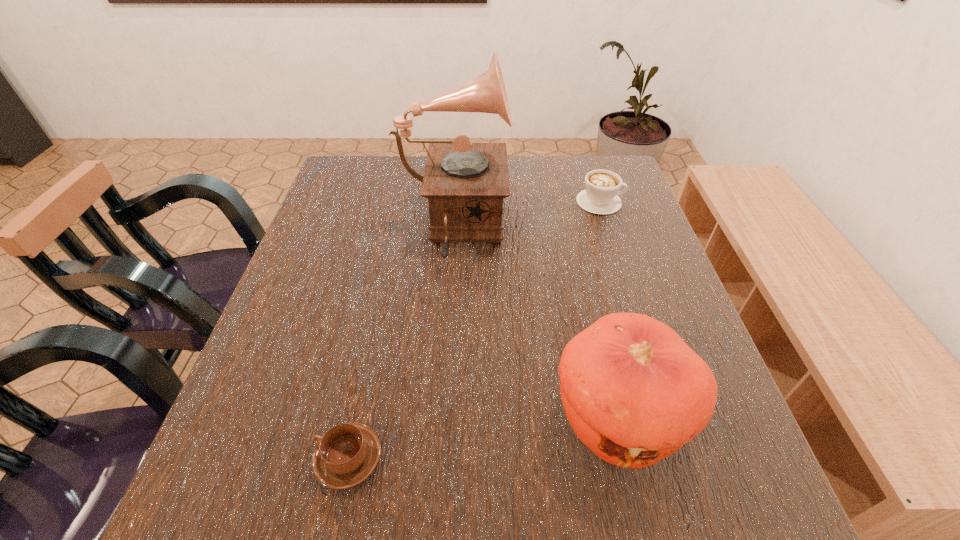
I want to click on record player, so pos(465,183).

This screenshot has height=540, width=960. I want to click on the second tallest object, so click(x=634, y=392).

The height and width of the screenshot is (540, 960). What are the coordinates of `the taller cappuccino` in the screenshot? It's located at (600, 196).

I want to click on the second shortest object, so click(x=600, y=196).

I want to click on the left cappuccino, so click(347, 454).

Find the location of a particular element. The height and width of the screenshot is (540, 960). the shorter cappuccino is located at coordinates (347, 454).

The image size is (960, 540). I want to click on free location located 0.100m on the horn of the tallest object, so click(x=547, y=231).

Where is `vacant region located on the back of the pumpkin`? This screenshot has height=540, width=960. vacant region located on the back of the pumpkin is located at coordinates (581, 264).

You are a GUI agent. You are given a task and a screenshot of the screen. Output one action in this format:
    pyautogui.click(x=<x>, y=<y>)
    Task: Click on the vacant area situated on the side of the shorter cappuccino with the handle
    The image size is (960, 540).
    Given the screenshot: What is the action you would take?
    pyautogui.click(x=247, y=458)

Find the location of `free space located 0.090m on the side of the shorter cappuccino with the handle`. free space located 0.090m on the side of the shorter cappuccino with the handle is located at coordinates (259, 458).